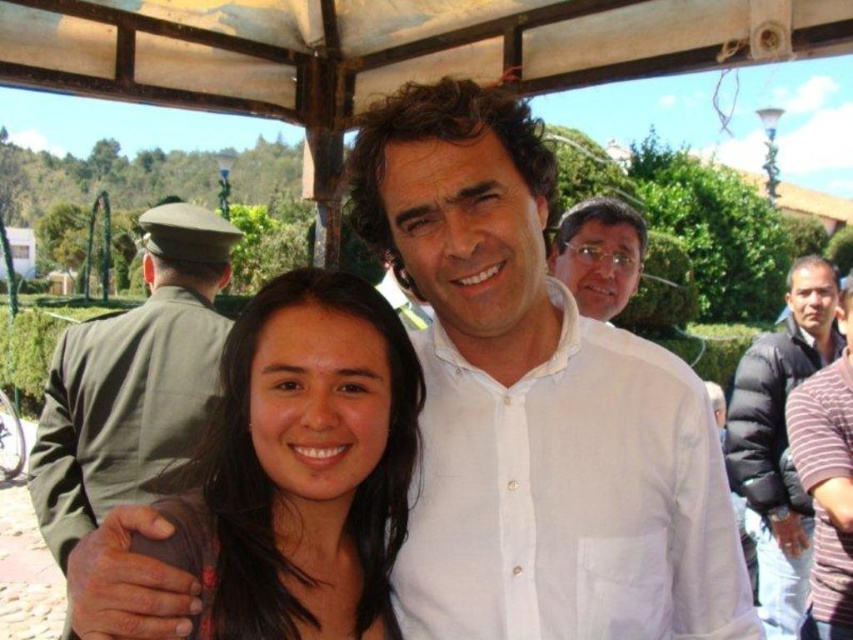
Based on the photo, you are a photographer trying to capture a group photo of the people in the scene. You notice the green uniform at left and the black puffy jacket at right. Which of these two items is positioned lower in the image?

The green uniform at left is located below the black puffy jacket at right, so it is positioned lower in the image.

You are a photographer trying to capture a clear shot of the white linen shirt at center and the brown hair at center. Based on their positions, which object is closer to the camera?

The white linen shirt at center is closer to the camera because the brown hair at center is behind it.

You are a photographer planning to take a group photo of the people in the scene. You notice the green uniform at left and the black puffy jacket at right. Which of these two items would appear smaller in the final photo?

The green uniform at left would appear smaller in the final photo because it has a smaller size compared to the black puffy jacket at right.